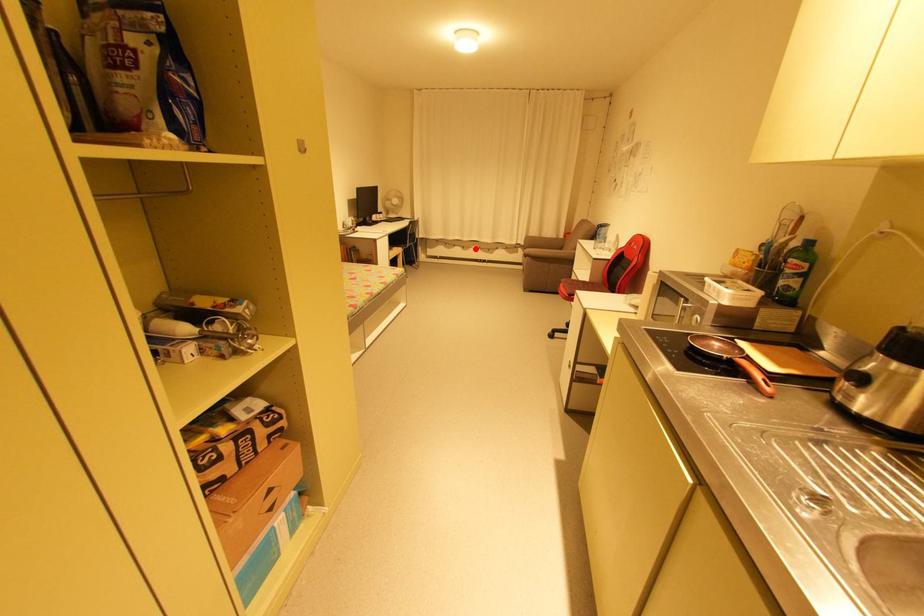
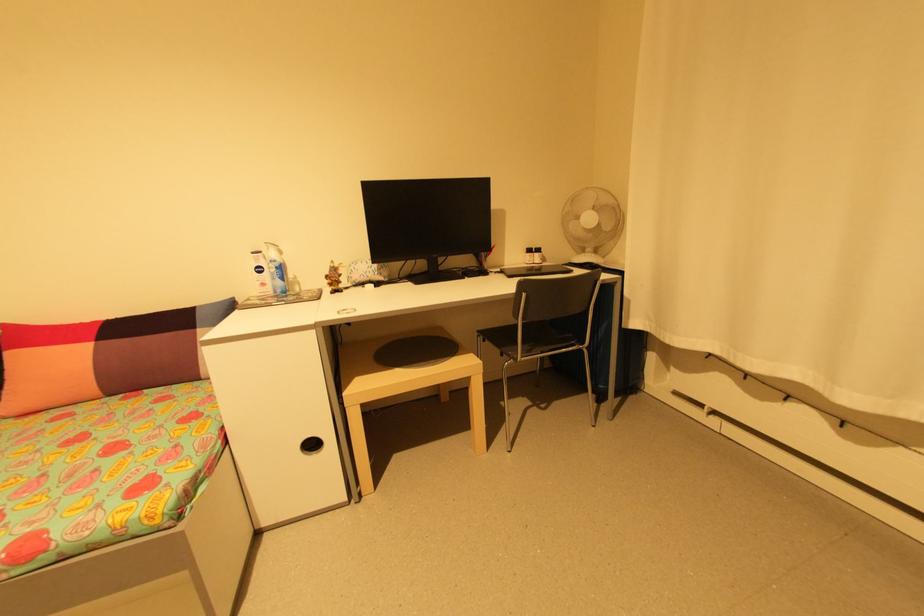
Question: I am providing you with two images of the same scene from different viewpoints. Given a red point in image1, look at the same physical point in image2. Is it:

Choices:
 (A) Closer to the viewpoint
 (B) Farther from the viewpoint

Answer: (B)